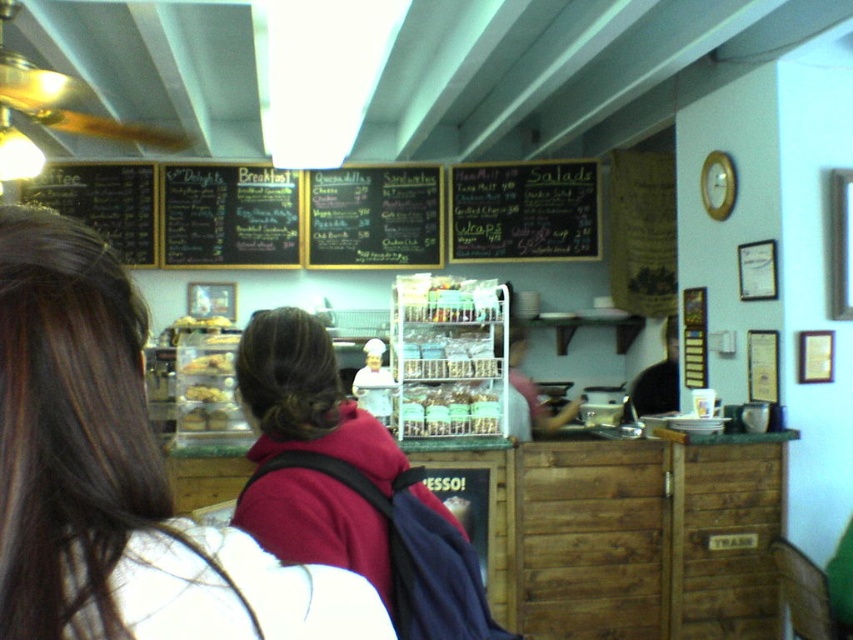
Question: Which object is the farthest from the black chalkboard at upper left?

Choices:
 (A) matte plastic bagel at center
 (B) matte black hair at upper left
 (C) black chalkboard menu at center
 (D) translucent plastic containers at center

Answer: (B)

Question: Considering the relative positions of black chalkboard at upper left and matte plastic pastry at center in the image provided, where is black chalkboard at upper left located with respect to matte plastic pastry at center?

Choices:
 (A) above
 (B) below

Answer: (A)

Question: Is matte black hair at upper left above maroon fleece jacket at center?

Choices:
 (A) no
 (B) yes

Answer: (B)

Question: Among these points, which one is farthest from the camera?

Choices:
 (A) (335, 186)
 (B) (216, 352)
 (C) (3, 481)

Answer: (A)

Question: Which object appears closest to the camera in this image?

Choices:
 (A) matte plastic pastry at center
 (B) black chalkboard menu at center
 (C) black chalkboard at center
 (D) translucent plastic containers at center

Answer: (A)

Question: Can you confirm if black chalkboard menu at center is thinner than translucent plastic containers at center?

Choices:
 (A) no
 (B) yes

Answer: (A)